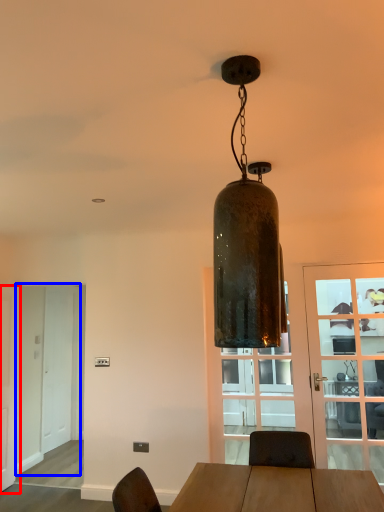
Question: Which point is closer to the camera, door (highlighted by a red box) or screen door (highlighted by a blue box)?

Choices:
 (A) door
 (B) screen door

Answer: (A)